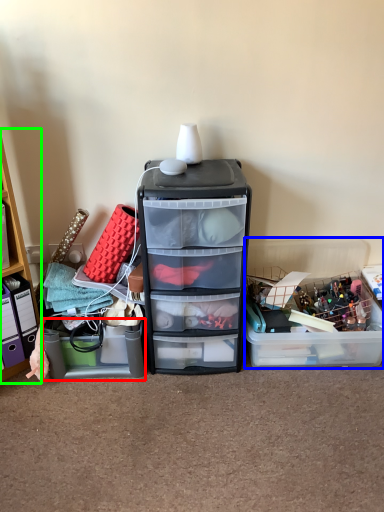
Question: Based on their relative distances, which object is farther from storage box (highlighted by a red box)? Choose from storage box (highlighted by a blue box) and cabinetry (highlighted by a green box).

Choices:
 (A) storage box
 (B) cabinetry

Answer: (A)